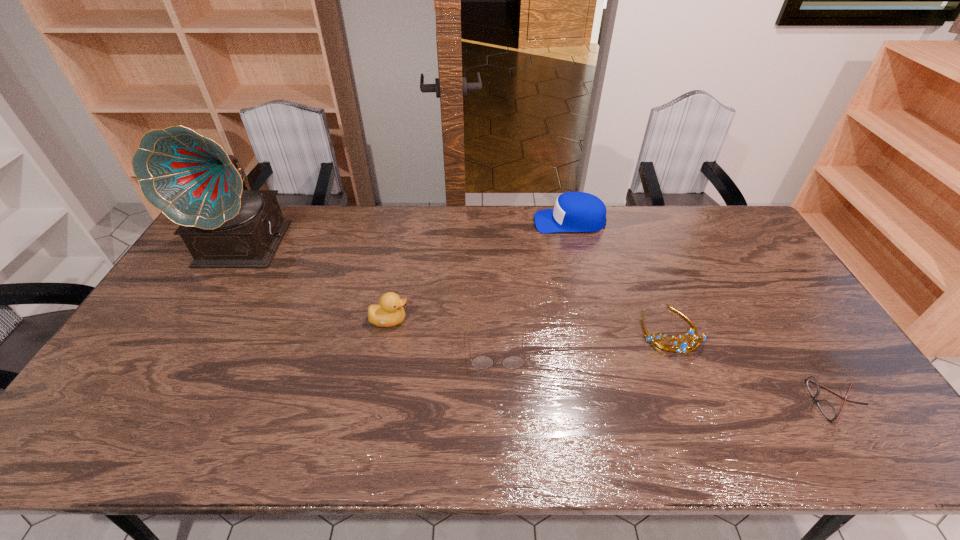
Where is `the leftmost object`? The width and height of the screenshot is (960, 540). the leftmost object is located at coordinates (190, 178).

The width and height of the screenshot is (960, 540). In order to click on record player in this screenshot , I will do `click(190, 178)`.

Identify the location of baseball cap. (x=573, y=211).

This screenshot has height=540, width=960. What are the coordinates of `the second object from left to right` in the screenshot? It's located at (389, 312).

What are the coordinates of `tiara` in the screenshot? It's located at (683, 347).

You are a GUI agent. You are given a task and a screenshot of the screen. Output one action in this format:
    pyautogui.click(x=<x>, y=<y>)
    Task: Click on the farther spectacles
    The height and width of the screenshot is (540, 960).
    Given the screenshot: What is the action you would take?
    pyautogui.click(x=480, y=362)

Locate an element on the screen. This screenshot has height=540, width=960. the fifth tallest object is located at coordinates (480, 362).

Where is `the nearer spectacles`? the nearer spectacles is located at coordinates (827, 409).

Where is `the nearest object`? the nearest object is located at coordinates (827, 409).

The width and height of the screenshot is (960, 540). I want to click on free space located 0.400m on the horn of the leftmost object, so click(166, 386).